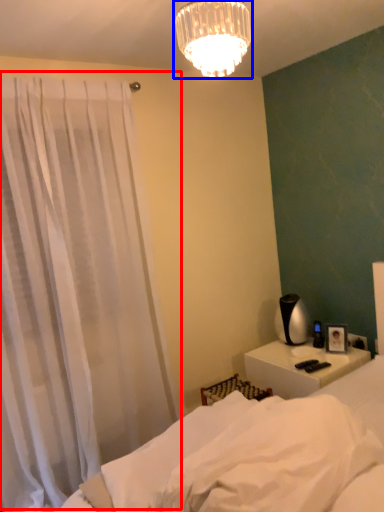
Question: Which of the following is the farthest to the observer, curtain (highlighted by a red box) or lamp (highlighted by a blue box)?

Choices:
 (A) curtain
 (B) lamp

Answer: (A)